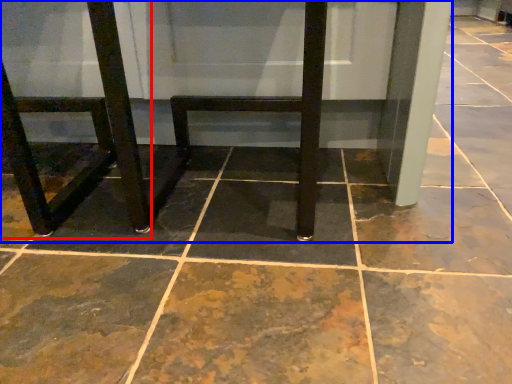
Question: Which object appears closest to the camera in this image, chair (highlighted by a red box) or furniture (highlighted by a blue box)?

Choices:
 (A) chair
 (B) furniture

Answer: (A)